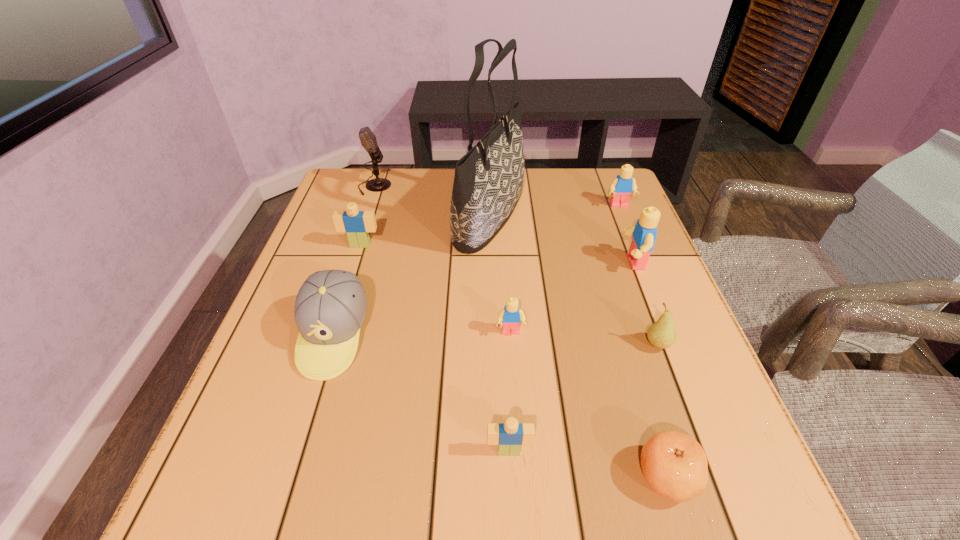
The width and height of the screenshot is (960, 540). Identify the location of the closest yellow Lego to the farthest Lego. (644, 233).

Locate an element on the screen. Image resolution: width=960 pixels, height=540 pixels. free space that satisfies the following two spatial constraints: 1. on the face of the left beige Lego; 2. on the right side of the pear is located at coordinates (329, 345).

Find the location of a particular element. The width and height of the screenshot is (960, 540). vacant region that satisfies the following two spatial constraints: 1. on the front-facing side of the pear; 2. on the left side of the leftmost yellow Lego is located at coordinates (512, 345).

Where is `free space that satisfies the following two spatial constraints: 1. on the front side of the tote bag; 2. on the right side of the pear`? This screenshot has height=540, width=960. free space that satisfies the following two spatial constraints: 1. on the front side of the tote bag; 2. on the right side of the pear is located at coordinates (493, 345).

Where is `vacant space that satisfies the following two spatial constraints: 1. on the face of the nearest Lego; 2. on the left side of the shortest object`? vacant space that satisfies the following two spatial constraints: 1. on the face of the nearest Lego; 2. on the left side of the shortest object is located at coordinates (510, 476).

Identify the location of vacant region that satisfies the following two spatial constraints: 1. on the front-facing side of the leftmost yellow Lego; 2. on the right side of the pear. The height and width of the screenshot is (540, 960). (512, 345).